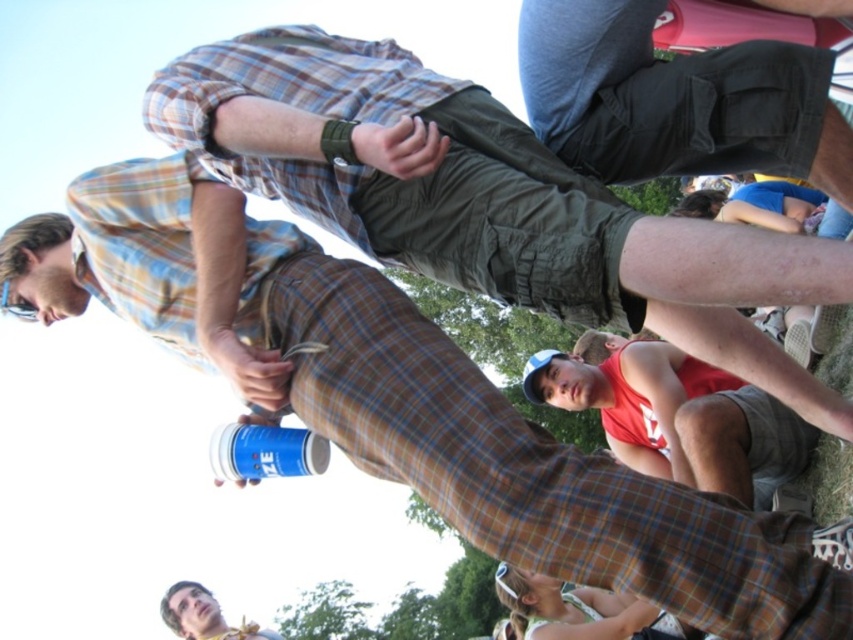
You are a photographer trying to capture a candid shot of the dark gray cargo shorts at center and the smooth skin face at lower left. Since you want both subjects to be in focus, which one should you adjust your camera focus on first considering their relative sizes in the frame?

The dark gray cargo shorts at center has a lesser width compared to smooth skin face at lower left, so you should focus on the smooth skin face at lower left first because it is larger and will require more precise focus to ensure clarity.

You are a photographer trying to capture a candid shot of the smooth skin face at lower left without including the dark gray cargo shorts at center in the frame. Based on their positions, is this possible?

The dark gray cargo shorts at center is closer to the viewer than the smooth skin face at lower left, so the photographer cannot capture the smooth skin face at lower left without including the dark gray cargo shorts at center in the frame because the shorts are in front of the face.

Based on the photo, you are a photographer trying to capture a candid shot of the smooth skin face at lower left without getting too close to the dark gray cargo shorts at center. Given that your camera has a maximum zoom range of 50 meters, can you achieve this?

The distance between the dark gray cargo shorts at center and the smooth skin face at lower left is 74.32 meters, which exceeds the camera maximum zoom range of 50 meters. Therefore, you cannot capture the smooth skin face at lower left without getting closer.